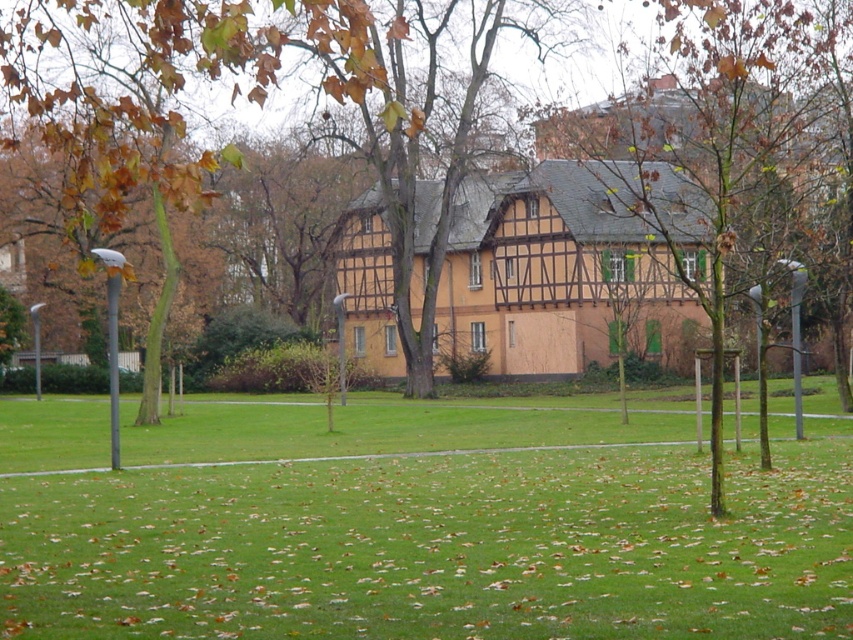
You are planning to place a picnic blanket in the park. Given the presence of the green grass at center and the brown textured tree at center, which area would be more suitable for the blanket and why?

The green grass at center is more suitable for placing the picnic blanket because it is smaller than the brown textured tree at center, making it a clearer and more open space.

You are standing at the entrance of the park and want to reach the green grass at center. According to the coordinates provided, in which direction should you walk from your current position?

The green grass at center is located at coordinates point [428,532]. Since you are at the entrance, which is likely at the edge of the scene, you should walk towards the center of the park to reach the green grass at center.

Looking at this image, you are standing at the camera position and want to walk to both points in the image. Which point should you reach first, point (483,483) or point (712,360)?

You will reach point (483,483) first because it is closer to the camera than point (712,360).